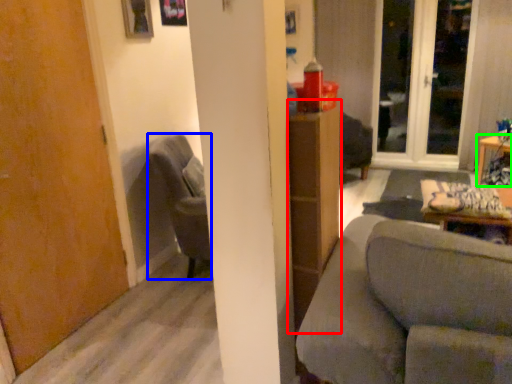
Question: Estimate the real-world distances between objects in this image. Which object is farther from dresser (highlighted by a red box), chair (highlighted by a blue box) or table (highlighted by a green box)?

Choices:
 (A) chair
 (B) table

Answer: (B)